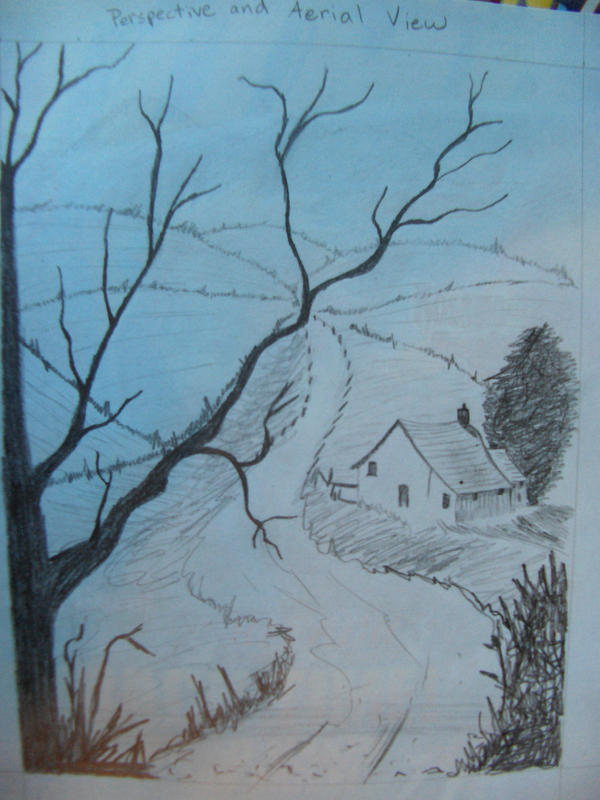
Where is `chimney`? chimney is located at coordinates (462, 409).